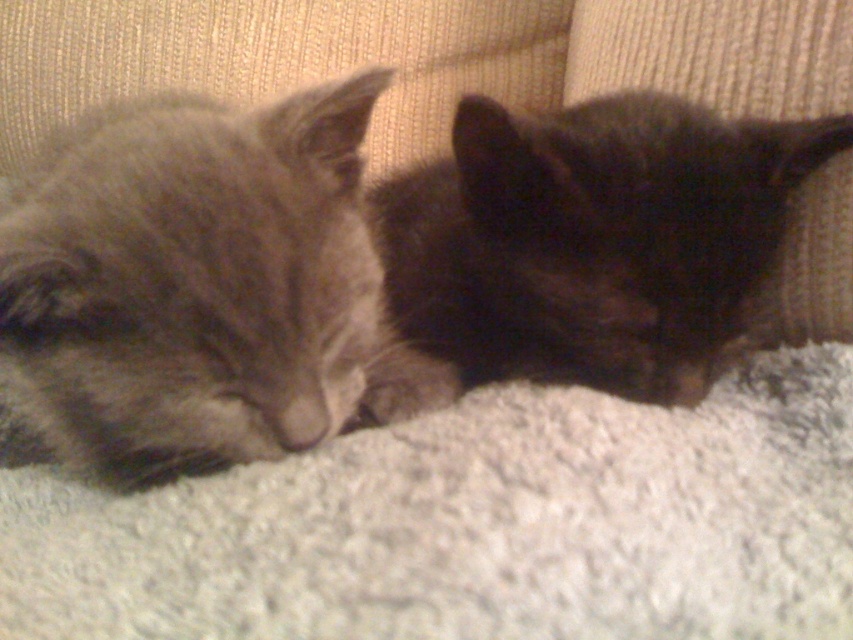
Question: Which object appears farthest from the camera in this image?

Choices:
 (A) black fur cat at center
 (B) gray fur cat at left

Answer: (A)

Question: Does gray fur cat at left come behind black fur cat at center?

Choices:
 (A) no
 (B) yes

Answer: (A)

Question: Which point appears closest to the camera in this image?

Choices:
 (A) (337, 116)
 (B) (633, 323)

Answer: (A)

Question: Can you confirm if gray fur cat at left is positioned to the right of black fur cat at center?

Choices:
 (A) yes
 (B) no

Answer: (B)

Question: Among these objects, which one is farthest from the camera?

Choices:
 (A) gray fur cat at left
 (B) black fur cat at center

Answer: (B)

Question: Is gray fur cat at left in front of black fur cat at center?

Choices:
 (A) no
 (B) yes

Answer: (B)